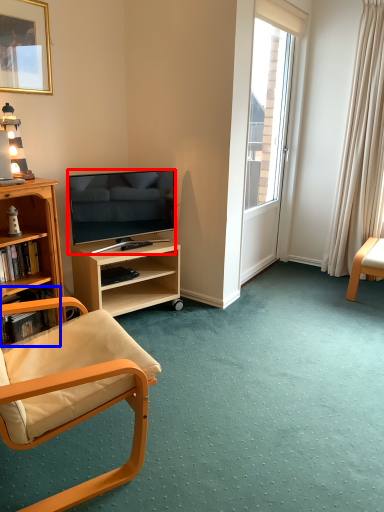
Question: Which point is closer to the camera, television (highlighted by a red box) or shelf (highlighted by a blue box)?

Choices:
 (A) television
 (B) shelf

Answer: (B)